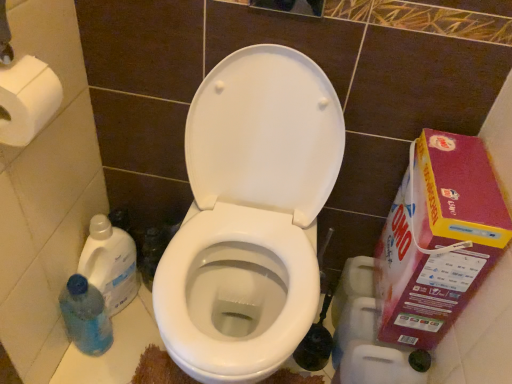
Question: Should I look upward or downward to see blue translucent bottle at lower left, which is the 1th cleaning product in bottom-to-top order?

Choices:
 (A) down
 (B) up

Answer: (A)

Question: From the image's perspective, is blue translucent bottle at lower left, which ranks as the 2th cleaning product in top-to-bottom order, below blue translucent bottle at lower left, which ranks as the second cleaning product in bottom-to-top order?

Choices:
 (A) no
 (B) yes

Answer: (B)

Question: Is blue translucent bottle at lower left, which is the 1th cleaning product in bottom-to-top order, wider than blue translucent bottle at lower left, positioned as the 1th cleaning product in top-to-bottom order?

Choices:
 (A) no
 (B) yes

Answer: (A)

Question: Can you confirm if blue translucent bottle at lower left, which ranks as the 2th cleaning product in top-to-bottom order, is positioned to the left of blue translucent bottle at lower left, which ranks as the second cleaning product in bottom-to-top order?

Choices:
 (A) no
 (B) yes

Answer: (B)

Question: Would you say blue translucent bottle at lower left, which is the 1th cleaning product in bottom-to-top order, contains blue translucent bottle at lower left, positioned as the 1th cleaning product in top-to-bottom order?

Choices:
 (A) no
 (B) yes

Answer: (A)

Question: Would you say blue translucent bottle at lower left, which ranks as the 2th cleaning product in top-to-bottom order, is outside blue translucent bottle at lower left, positioned as the 1th cleaning product in top-to-bottom order?

Choices:
 (A) yes
 (B) no

Answer: (A)

Question: Can you confirm if blue translucent bottle at lower left, which is the 1th cleaning product in bottom-to-top order, is bigger than blue translucent bottle at lower left, positioned as the 1th cleaning product in top-to-bottom order?

Choices:
 (A) yes
 (B) no

Answer: (B)

Question: From a real-world perspective, is white glossy toilet at center under blue translucent bottle at lower left, which is the 1th cleaning product in bottom-to-top order?

Choices:
 (A) yes
 (B) no

Answer: (B)

Question: From the image's perspective, is white glossy toilet at center on top of blue translucent bottle at lower left, which is the 1th cleaning product in bottom-to-top order?

Choices:
 (A) no
 (B) yes

Answer: (B)

Question: Considering the relative sizes of white glossy toilet at center and blue translucent bottle at lower left, which is the 1th cleaning product in bottom-to-top order, in the image provided, is white glossy toilet at center taller than blue translucent bottle at lower left, which is the 1th cleaning product in bottom-to-top order,?

Choices:
 (A) no
 (B) yes

Answer: (B)

Question: Considering the relative sizes of white glossy toilet at center and blue translucent bottle at lower left, which is the 1th cleaning product in bottom-to-top order, in the image provided, is white glossy toilet at center bigger than blue translucent bottle at lower left, which is the 1th cleaning product in bottom-to-top order,?

Choices:
 (A) yes
 (B) no

Answer: (A)

Question: From a real-world perspective, is white glossy toilet at center positioned over blue translucent bottle at lower left, which is the 1th cleaning product in bottom-to-top order, based on gravity?

Choices:
 (A) yes
 (B) no

Answer: (A)

Question: Would you say white glossy toilet at center is outside blue translucent bottle at lower left, which ranks as the 2th cleaning product in top-to-bottom order?

Choices:
 (A) yes
 (B) no

Answer: (A)

Question: Can you confirm if pink cardboard box at right is bigger than blue translucent bottle at lower left, which ranks as the 2th cleaning product in top-to-bottom order?

Choices:
 (A) yes
 (B) no

Answer: (A)